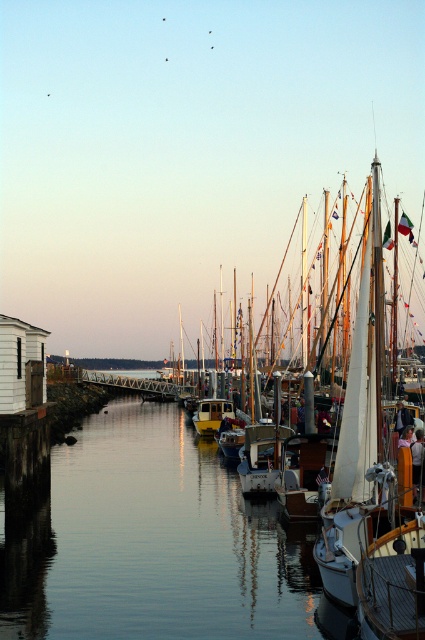
Question: Which point is closer to the camera?

Choices:
 (A) (130, 435)
 (B) (227, 412)

Answer: (B)

Question: Is smooth water at center below yellow matte boat at center?

Choices:
 (A) yes
 (B) no

Answer: (A)

Question: Which object is farther from the camera taking this photo?

Choices:
 (A) smooth water at center
 (B) yellow matte boat at center

Answer: (B)

Question: Considering the relative positions of smooth water at center and yellow matte boat at center in the image provided, where is smooth water at center located with respect to yellow matte boat at center?

Choices:
 (A) right
 (B) left

Answer: (B)

Question: Which point is farther to the camera?

Choices:
 (A) (152, 496)
 (B) (192, 417)

Answer: (B)

Question: Does smooth water at center come behind yellow matte boat at center?

Choices:
 (A) yes
 (B) no

Answer: (B)